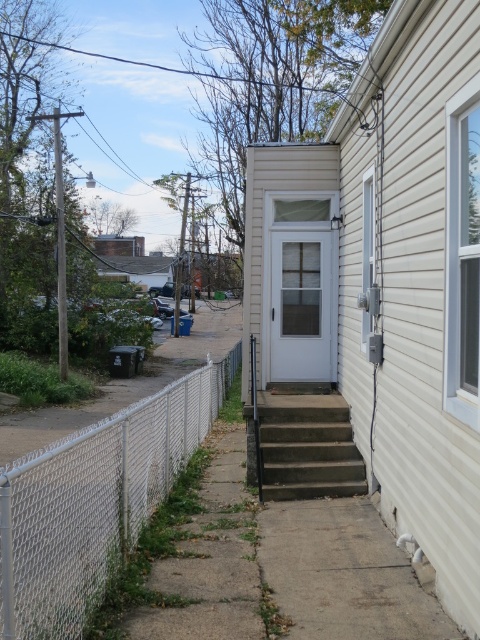
Question: Can you confirm if concrete sidewalk at lower center is bigger than concrete/steps at lower center?

Choices:
 (A) no
 (B) yes

Answer: (A)

Question: Which point is farther from the camera taking this photo?

Choices:
 (A) (156, 484)
 (B) (317, 243)
 (C) (299, 483)

Answer: (B)

Question: Among these objects, which one is farthest from the camera?

Choices:
 (A) concrete/steps at lower center
 (B) concrete sidewalk at lower center
 (C) white chain-link fence at lower left
 (D) white glass door at center

Answer: (D)

Question: Can you confirm if concrete sidewalk at lower center is positioned above white chain-link fence at lower left?

Choices:
 (A) yes
 (B) no

Answer: (B)

Question: Which object is the farthest from the white chain-link fence at lower left?

Choices:
 (A) concrete/steps at lower center
 (B) concrete sidewalk at lower center
 (C) white glass door at center

Answer: (B)

Question: From the image, what is the correct spatial relationship of white chain-link fence at lower left in relation to concrete/steps at lower center?

Choices:
 (A) right
 (B) left

Answer: (B)